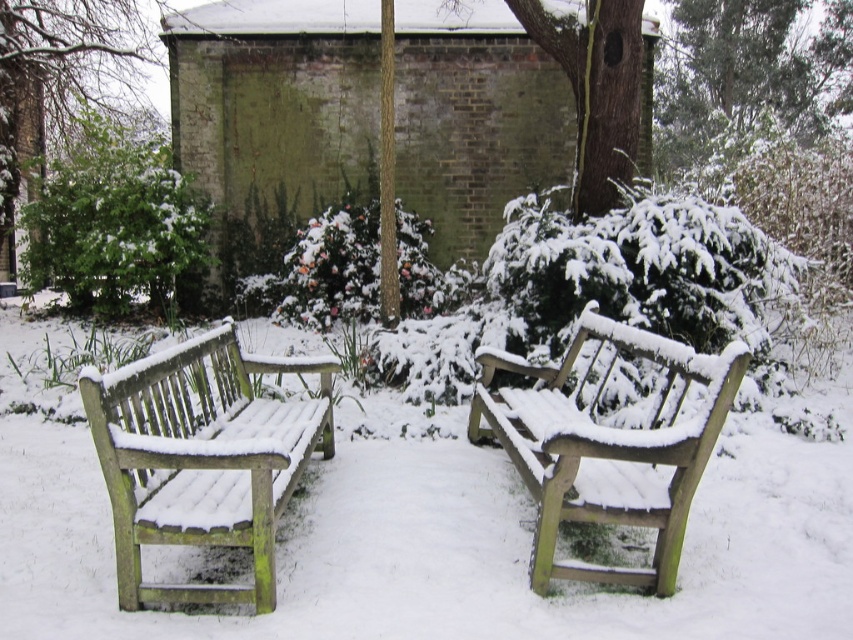
Can you confirm if green wood bench at left is smaller than snow-covered wood bench at center?

Yes.

Between green wood bench at left and snow-covered wood bench at center, which one is positioned higher?

snow-covered wood bench at center is higher up.

Which is behind, point (86, 371) or point (668, 442)?

Positioned behind is point (668, 442).

The height and width of the screenshot is (640, 853). In order to click on green wood bench at left in this screenshot , I will do `click(202, 458)`.